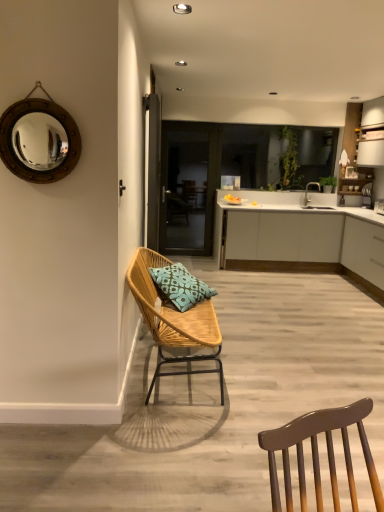
Question: Should I look upward or downward to see white matte cabinet at right, which is counted as the first cabinetry, starting from the front?

Choices:
 (A) down
 (B) up

Answer: (B)

Question: From the image's perspective, would you say transparent glass door at center is positioned over white matte cabinet at center, the 2th cabinetry in the front-to-back sequence?

Choices:
 (A) no
 (B) yes

Answer: (B)

Question: Is transparent glass door at center wider than white matte cabinet at center, acting as the first cabinetry starting from the back?

Choices:
 (A) no
 (B) yes

Answer: (A)

Question: Considering the relative sizes of transparent glass door at center and white matte cabinet at center, the 2th cabinetry in the front-to-back sequence, in the image provided, is transparent glass door at center thinner than white matte cabinet at center, the 2th cabinetry in the front-to-back sequence,?

Choices:
 (A) no
 (B) yes

Answer: (B)

Question: Is transparent glass door at center not close to white matte cabinet at center, acting as the first cabinetry starting from the back?

Choices:
 (A) yes
 (B) no

Answer: (A)

Question: Is transparent glass door at center taller than white matte cabinet at center, the 2th cabinetry in the front-to-back sequence?

Choices:
 (A) no
 (B) yes

Answer: (B)

Question: Is transparent glass door at center at the left side of white matte cabinet at center, the 2th cabinetry in the front-to-back sequence?

Choices:
 (A) no
 (B) yes

Answer: (B)

Question: Considering the relative sizes of wooden frame mirror at upper left and teal fabric pillow at center in the image provided, is wooden frame mirror at upper left bigger than teal fabric pillow at center?

Choices:
 (A) yes
 (B) no

Answer: (B)

Question: Can you confirm if wooden frame mirror at upper left is shorter than teal fabric pillow at center?

Choices:
 (A) yes
 (B) no

Answer: (B)

Question: Is wooden frame mirror at upper left wider than teal fabric pillow at center?

Choices:
 (A) no
 (B) yes

Answer: (A)

Question: Does wooden frame mirror at upper left have a greater height compared to teal fabric pillow at center?

Choices:
 (A) yes
 (B) no

Answer: (A)

Question: Does wooden frame mirror at upper left touch teal fabric pillow at center?

Choices:
 (A) no
 (B) yes

Answer: (A)

Question: Does wooden frame mirror at upper left appear on the right side of teal fabric pillow at center?

Choices:
 (A) no
 (B) yes

Answer: (A)

Question: Is woven wood chair with blue patterned cushion at left located outside wooden frame mirror at upper left?

Choices:
 (A) yes
 (B) no

Answer: (A)